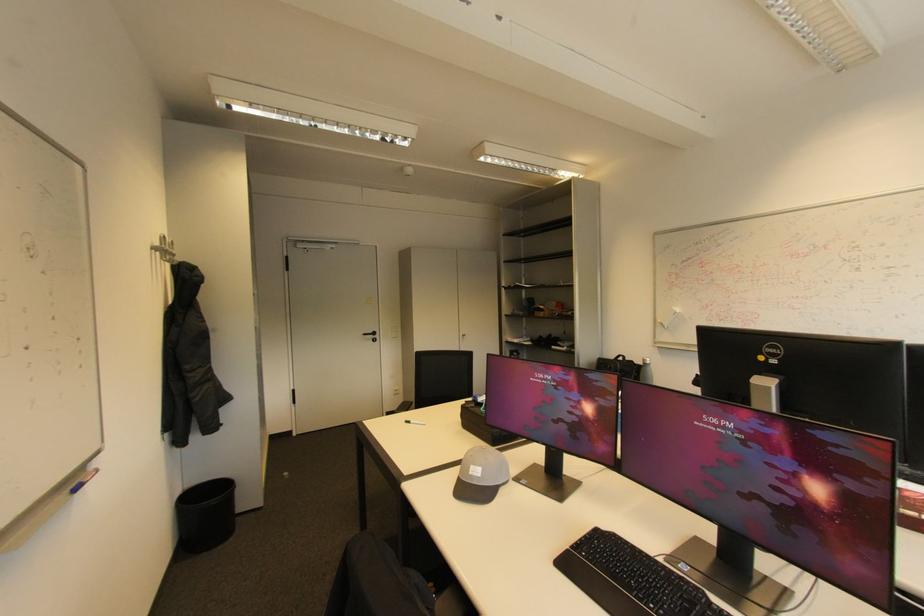
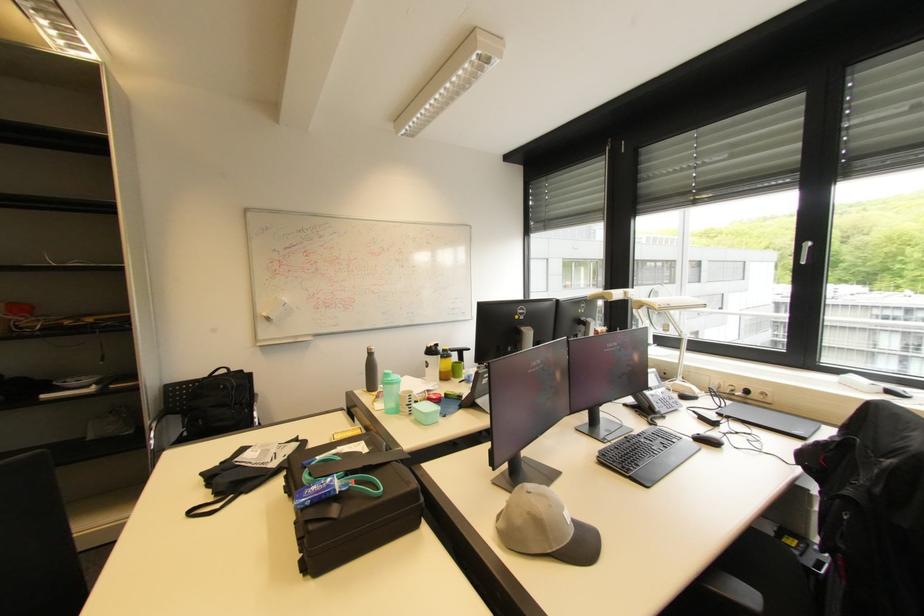
Locate, in the second image, the point that corresponds to the point at 631,360 in the first image.

(237, 371)